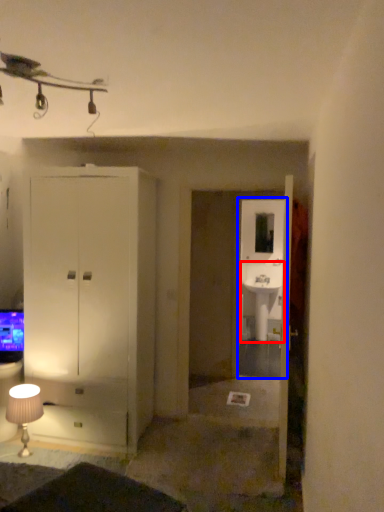
Question: Which object appears farthest to the camera in this image, sink (highlighted by a red box) or glass door (highlighted by a blue box)?

Choices:
 (A) sink
 (B) glass door

Answer: (A)